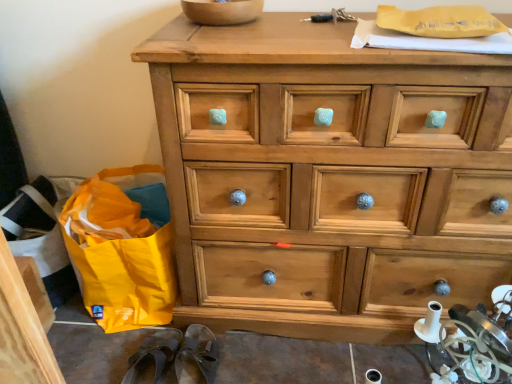
Question: Which direction should I rotate to look at brown leather slipper at lower center, which ranks as the 2th slipper in left-to-right order?

Choices:
 (A) right
 (B) left

Answer: (B)

Question: From a real-world perspective, is yellow fabric bag at lower left on top of brown leather slipper at lower center, acting as the first slipper starting from the right?

Choices:
 (A) yes
 (B) no

Answer: (A)

Question: Considering the relative positions of yellow fabric bag at lower left and brown leather slipper at lower center, which ranks as the 2th slipper in left-to-right order, in the image provided, is yellow fabric bag at lower left to the right of brown leather slipper at lower center, which ranks as the 2th slipper in left-to-right order, from the viewer's perspective?

Choices:
 (A) no
 (B) yes

Answer: (A)

Question: Would you say brown leather slipper at lower center, acting as the first slipper starting from the right, is part of yellow fabric bag at lower left's contents?

Choices:
 (A) no
 (B) yes

Answer: (A)

Question: Could you tell me if yellow fabric bag at lower left is turned towards brown leather slipper at lower center, acting as the first slipper starting from the right?

Choices:
 (A) yes
 (B) no

Answer: (B)

Question: Can you confirm if yellow fabric bag at lower left is positioned to the left of brown leather slipper at lower center, acting as the first slipper starting from the right?

Choices:
 (A) yes
 (B) no

Answer: (A)

Question: Would you say yellow fabric bag at lower left is a long distance from brown leather slipper at lower center, which ranks as the 2th slipper in left-to-right order?

Choices:
 (A) no
 (B) yes

Answer: (A)

Question: From the image's perspective, is natural wood chest of drawers at center over wooden bowl at upper center?

Choices:
 (A) no
 (B) yes

Answer: (A)

Question: Can you confirm if natural wood chest of drawers at center is bigger than wooden bowl at upper center?

Choices:
 (A) no
 (B) yes

Answer: (B)

Question: Is natural wood chest of drawers at center not close to wooden bowl at upper center?

Choices:
 (A) yes
 (B) no

Answer: (B)

Question: From a real-world perspective, is natural wood chest of drawers at center physically above wooden bowl at upper center?

Choices:
 (A) yes
 (B) no

Answer: (B)

Question: Is natural wood chest of drawers at center at the right side of wooden bowl at upper center?

Choices:
 (A) yes
 (B) no

Answer: (A)

Question: Can you confirm if natural wood chest of drawers at center is taller than wooden bowl at upper center?

Choices:
 (A) no
 (B) yes

Answer: (B)

Question: From the image's perspective, is brown leather slipper at lower left, the first slipper in the left-to-right sequence, located above wooden bowl at upper center?

Choices:
 (A) yes
 (B) no

Answer: (B)